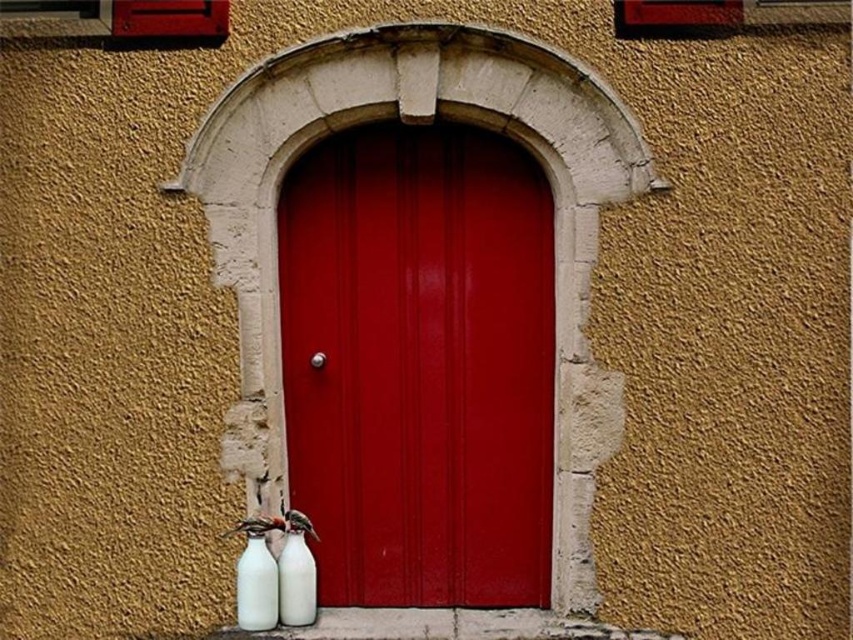
Question: Observing the image, what is the correct spatial positioning of white matte bottle at lower left in reference to white glossy bottle at lower center?

Choices:
 (A) above
 (B) below

Answer: (B)

Question: Which point is closer to the camera taking this photo?

Choices:
 (A) (460, 248)
 (B) (244, 624)
 (C) (288, 557)

Answer: (B)

Question: Which point is farther to the camera?

Choices:
 (A) glossy wood door at center
 (B) white glossy bottle at lower center

Answer: (A)

Question: Does white matte bottle at lower left have a lesser width compared to white glossy bottle at lower center?

Choices:
 (A) yes
 (B) no

Answer: (B)

Question: Considering the relative positions of glossy wood door at center and white glossy bottle at lower center in the image provided, where is glossy wood door at center located with respect to white glossy bottle at lower center?

Choices:
 (A) left
 (B) right

Answer: (B)

Question: Which object is the closest to the white matte bottle at lower left?

Choices:
 (A) white glossy bottle at lower center
 (B) glossy wood door at center

Answer: (A)